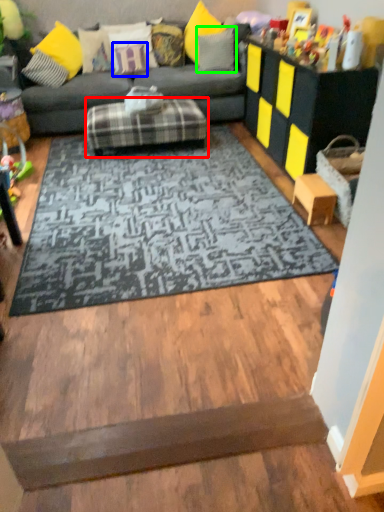
Question: Considering the real-world distances, which object is farthest from footrest (highlighted by a red box)? pillow (highlighted by a blue box) or pillow (highlighted by a green box)?

Choices:
 (A) pillow
 (B) pillow

Answer: (B)